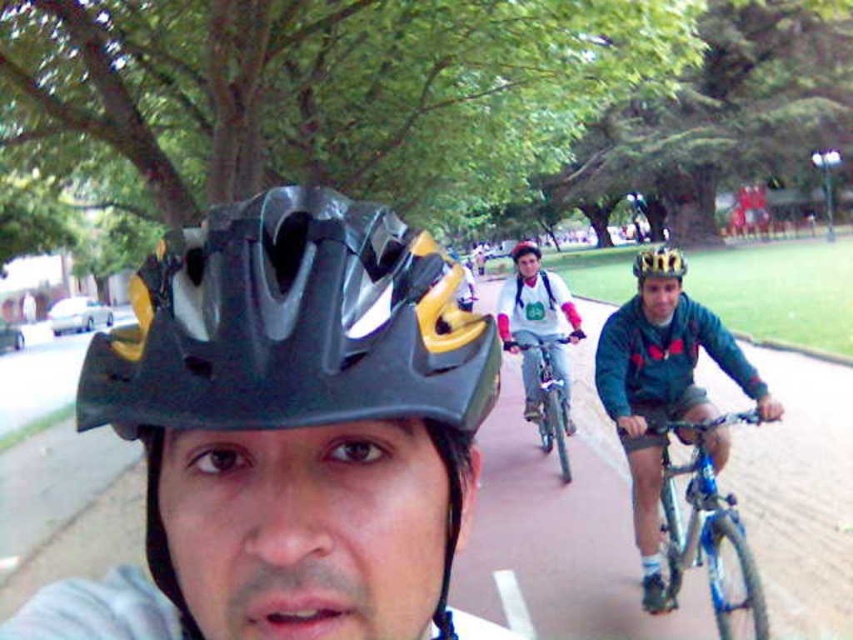
Question: Can you confirm if matte blue bicycle at right is positioned to the left of shiny metallic bicycle at center-right?

Choices:
 (A) no
 (B) yes

Answer: (A)

Question: Among these objects, which one is farthest from the camera?

Choices:
 (A) gold matte helmet at center
 (B) gold textured helmet at center

Answer: (A)

Question: Is blue metallic bicycle at center-right to the left of matte black helmet at center from the viewer's perspective?

Choices:
 (A) no
 (B) yes

Answer: (B)

Question: Which point is closer to the camera?

Choices:
 (A) matte blue bicycle at right
 (B) shiny metallic bicycle at center-right

Answer: (A)

Question: Is shiny metallic bicycle at center-right to the left of gold textured helmet at center from the viewer's perspective?

Choices:
 (A) no
 (B) yes

Answer: (B)

Question: Which object is the closest to the black matte helmet at center?

Choices:
 (A) matte blue bicycle at right
 (B) gold textured helmet at center
 (C) shiny metallic bicycle at center-right

Answer: (A)